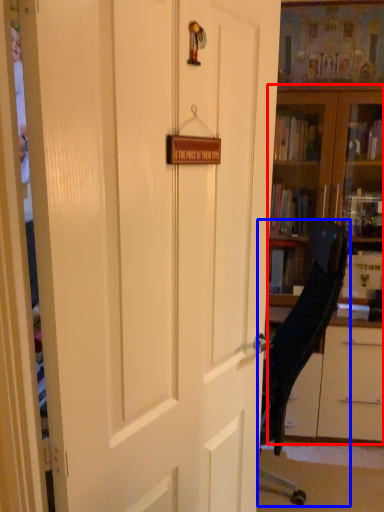
Question: Which of the following is the farthest to the observer, bookcase (highlighted by a red box) or chair (highlighted by a blue box)?

Choices:
 (A) bookcase
 (B) chair

Answer: (A)